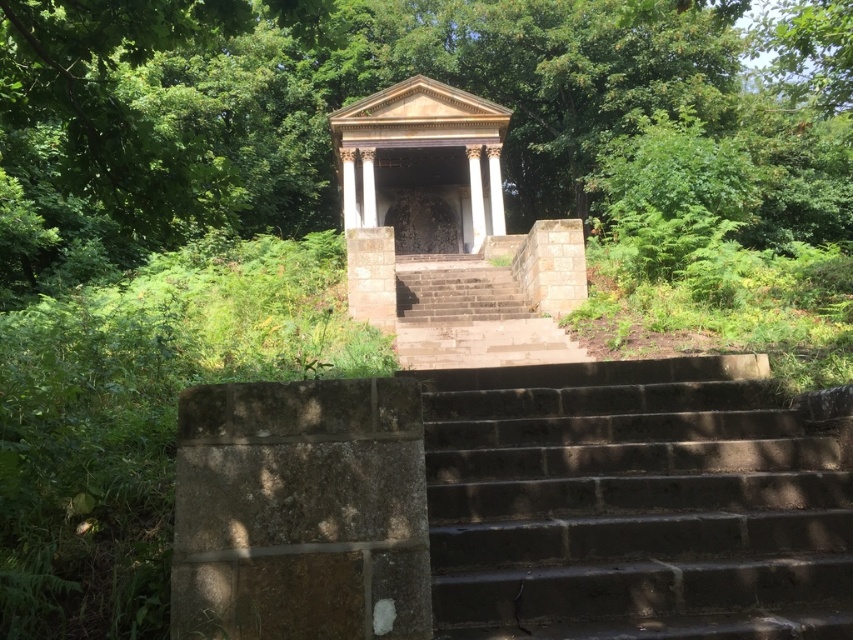
You are standing at the base of the classical structure and want to take a photo. There are two points marked in the scene, point (631, 515) and point (395, 220). Which point is closer to you?

Point (631, 515) is closer to the viewer than point (395, 220).

You are a landscape architect designing a garden path that needs to connect to both the dark gray concrete stairs at center and the brown stone gazebo at center. Given their widths, which one would require a wider path to maintain proportion?

The dark gray concrete stairs at center requires a wider path because its width is larger than the brown stone gazebo at center, so the path should match the stairs width to maintain proportion.